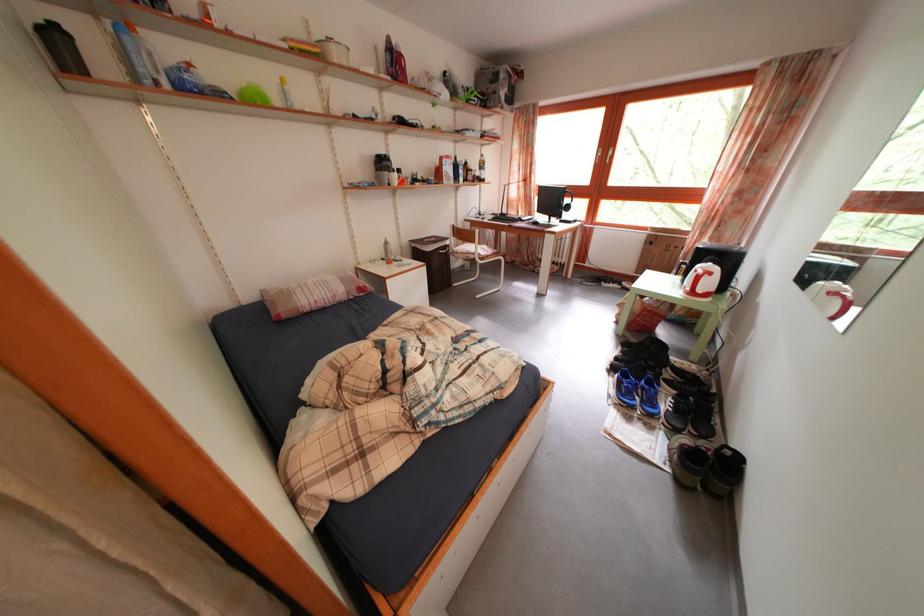
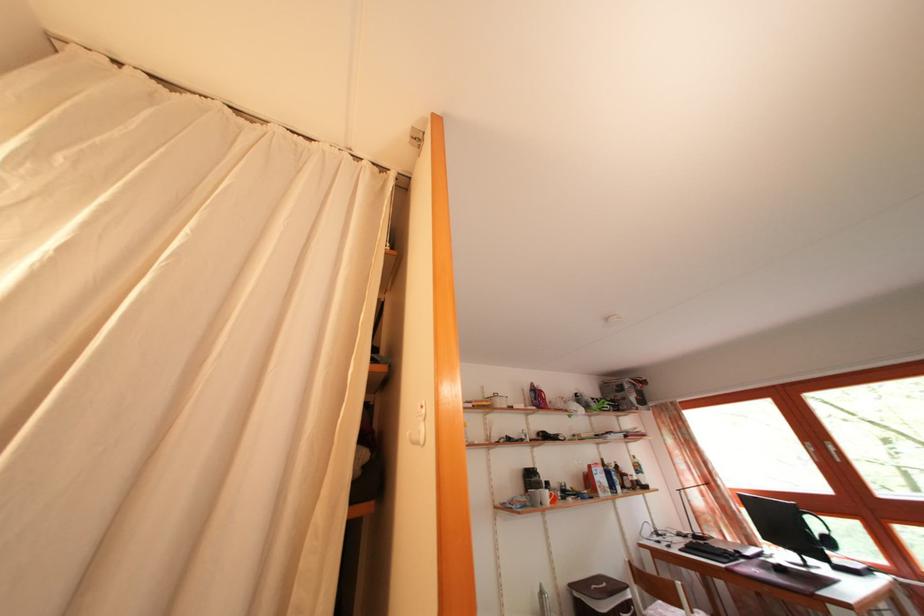
Where in the second image is the point corresponding to pixel 428 248 from the first image?

(592, 594)